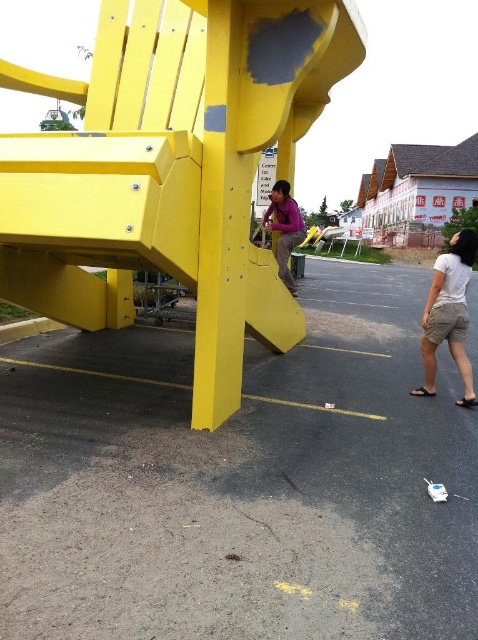
You are planning to place a small potted plant between the yellow matte bench at lower left and the purple matte shirt at center. Considering their sizes, which object will the plant be closer to?

The yellow matte bench at lower left is larger in size than the purple matte shirt at center, so the plant will be closer to the purple matte shirt at center to maintain balance.

What is the exact coordinate of the white cotton shirt at lower right?

The white cotton shirt at lower right is located at coordinate point (448, 314).